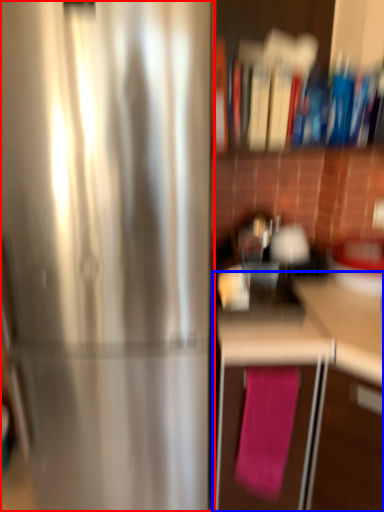
Question: Which of the following is the farthest to the observer, refrigerator (highlighted by a red box) or cabinetry (highlighted by a blue box)?

Choices:
 (A) refrigerator
 (B) cabinetry

Answer: (A)